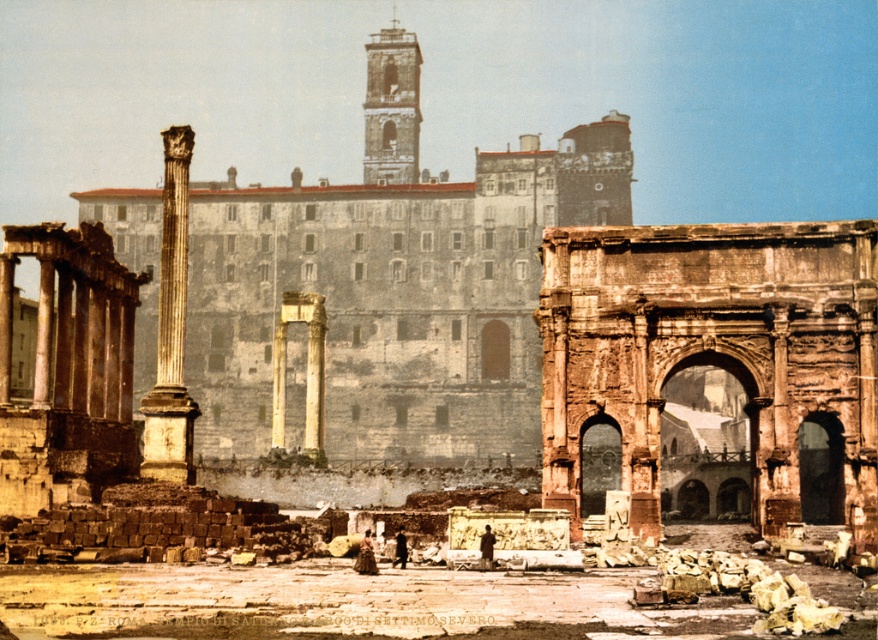
You are standing at the point labeled as point (394, 282) in the image. What object are you facing directly?

The point labeled as point (394, 282) corresponds to the stone column at left, so you are facing the stone column at left directly.

You are an archaeologist standing at the site of this ancient Roman ruin. You want to take a photo of the rusty stone arch at center from a distance that is exactly 70 meters away. Is it possible to do so given your current position?

The rusty stone arch at center is currently 73.95 meters away from your position. Since 73.95 meters is greater than 70 meters, you would need to move closer by approximately 3.95 meters to achieve the desired distance of 70 meters for your photo.